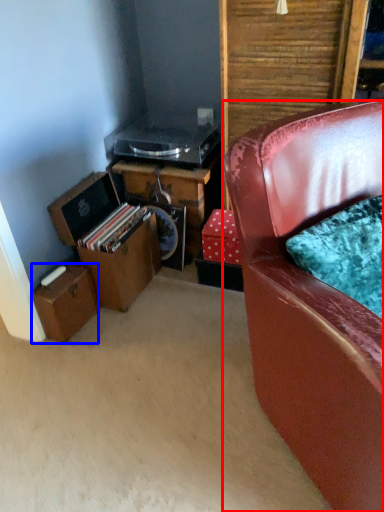
Question: Which object is further to the camera taking this photo, chair (highlighted by a red box) or box (highlighted by a blue box)?

Choices:
 (A) chair
 (B) box

Answer: (B)